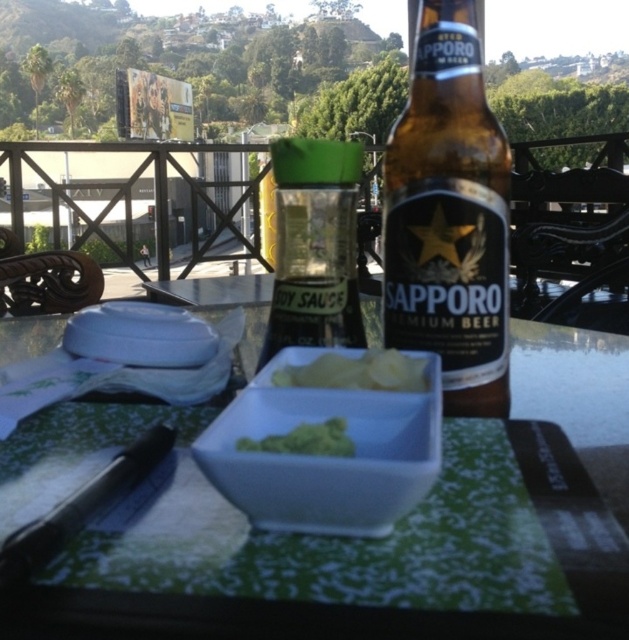
You are a food critic who needs to place a napkin between the brown glass beer bottle at center and the yellow creamy dip at center. Which object should you move to make space?

The brown glass beer bottle at center is larger in size than the yellow creamy dip at center, so you should move the brown glass beer bottle at center to make space.

You are a food delivery person who just arrived at the balcony. You need to place a new order on the table. The order is a large pizza box that requires 20 inches of space. Can you fit the pizza box on the white glossy table at center without overlapping the yellow creamy dip at center?

The white glossy table at center is wider than the yellow creamy dip at center, but the exact dimensions are not provided. However, since the table is wider, there might be enough space to place the pizza box without overlapping the dip. Check the available space carefully.

You are a server at a restaurant and need to place a new order on the table. The order includes a large platter that requires the full width of the table. Based on the image, can you confirm if the white glossy table at center has enough space to accommodate the platter without overlapping the green matte vegetable at center?

The white glossy table at center is wider than the green matte vegetable at center, so there should be sufficient space to place the large platter without overlapping the vegetable.